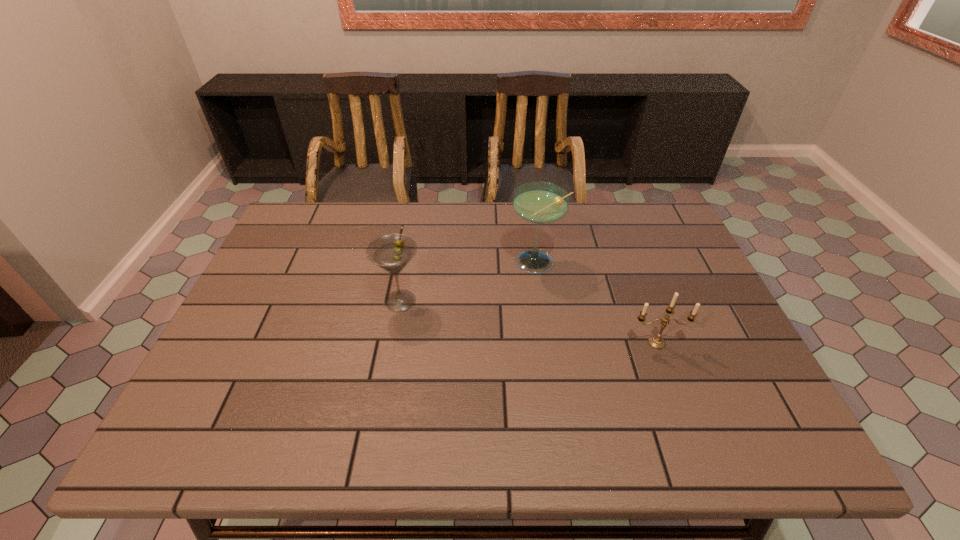
Where is `object that is at the right edge`? object that is at the right edge is located at coordinates (656, 342).

In order to click on vacant region at the far edge of the desktop in this screenshot , I will do `click(582, 233)`.

You are a GUI agent. You are given a task and a screenshot of the screen. Output one action in this format:
    pyautogui.click(x=<x>, y=<y>)
    Task: Click on the vacant space at the near edge
    
    Given the screenshot: What is the action you would take?
    pyautogui.click(x=300, y=431)

Find the location of a particular element. The width and height of the screenshot is (960, 540). free space at the left edge of the desktop is located at coordinates (316, 247).

Where is `vacant space at the right edge of the desktop`? This screenshot has width=960, height=540. vacant space at the right edge of the desktop is located at coordinates (688, 342).

Locate an element on the screen. The width and height of the screenshot is (960, 540). free space between the leftmost object and the rightmost object is located at coordinates (529, 322).

This screenshot has height=540, width=960. What are the coordinates of `free spot between the second object from left to right and the rightmost object` in the screenshot? It's located at (596, 303).

Locate an element on the screen. This screenshot has width=960, height=540. vacant area that lies between the leftmost object and the rightmost object is located at coordinates (529, 322).

Identify the location of empty location between the candle and the farthest object. The height and width of the screenshot is (540, 960). (596, 303).

Identify the location of vacant area that lies between the rightmost object and the leftmost object. The image size is (960, 540). coord(529,322).